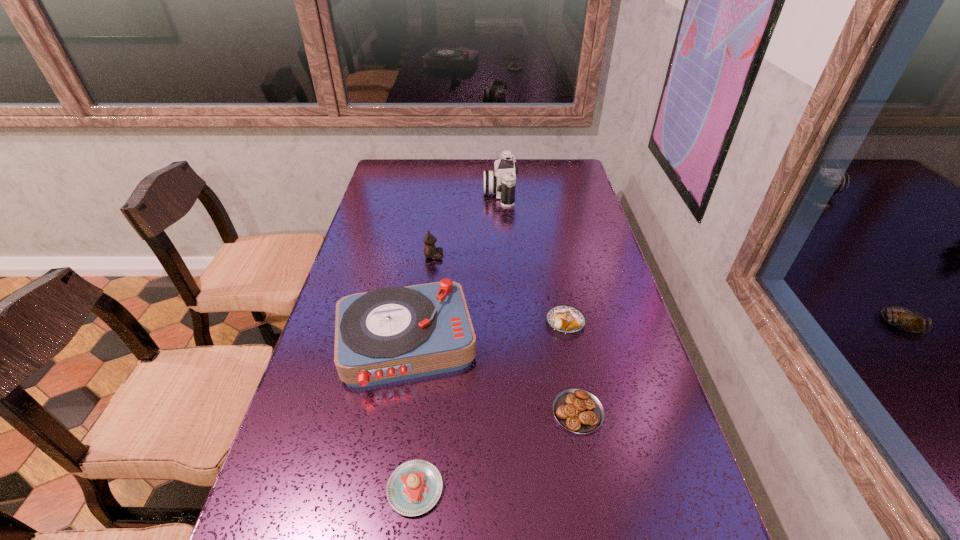
Where is `the tallest object`? This screenshot has width=960, height=540. the tallest object is located at coordinates (502, 181).

The height and width of the screenshot is (540, 960). I want to click on the farthest object, so click(502, 181).

Locate an element on the screen. The height and width of the screenshot is (540, 960). record player is located at coordinates pyautogui.click(x=390, y=334).

The image size is (960, 540). What are the coordinates of `the fifth nearest object` in the screenshot? It's located at (430, 251).

Identify the location of teddy bear. Image resolution: width=960 pixels, height=540 pixels. (430, 251).

The image size is (960, 540). Find the location of `the farthest pastry`. the farthest pastry is located at coordinates (565, 319).

Image resolution: width=960 pixels, height=540 pixels. In order to click on the nearest pastry in this screenshot , I will do `click(414, 487)`.

You are a GUI agent. You are given a task and a screenshot of the screen. Output one action in this format:
    pyautogui.click(x=<x>, y=<y>)
    Task: Click on the nearest object
    The height and width of the screenshot is (540, 960).
    Given the screenshot: What is the action you would take?
    pyautogui.click(x=414, y=487)

The image size is (960, 540). In order to click on the second farthest pastry in this screenshot , I will do `click(578, 411)`.

Where is `vacant position located on the front of the tallest object`? vacant position located on the front of the tallest object is located at coordinates (505, 265).